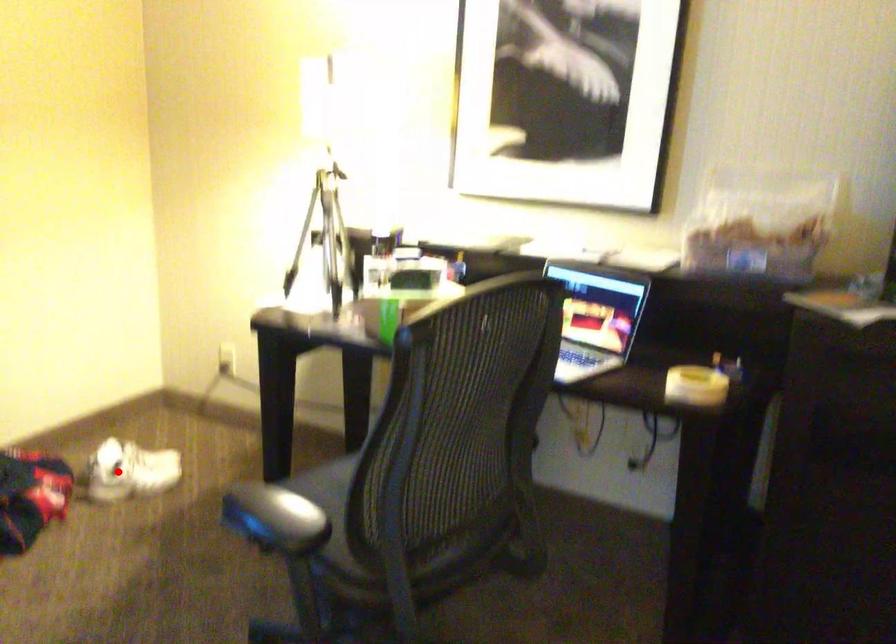
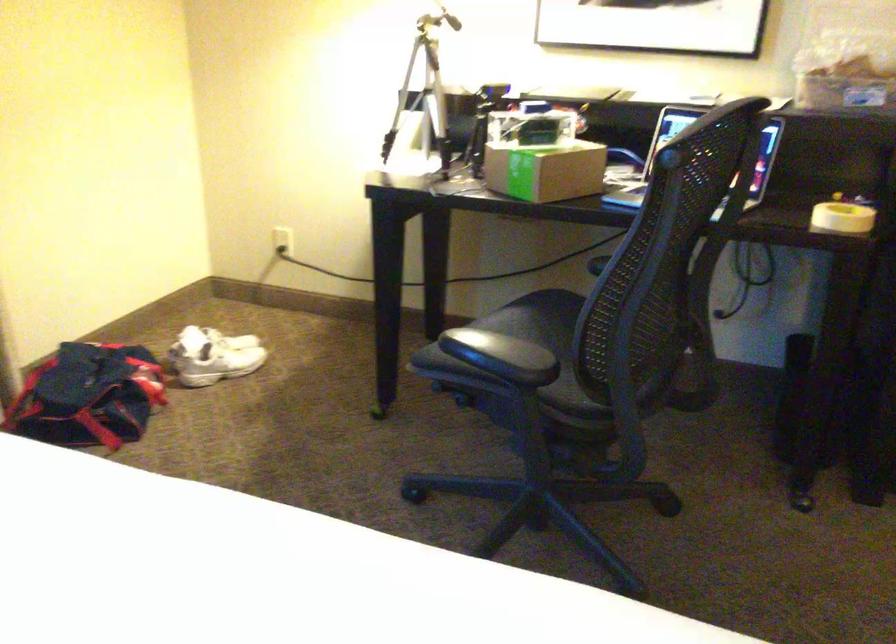
Find the pixel in the second image that matches the highlighted location in the first image.

(213, 355)